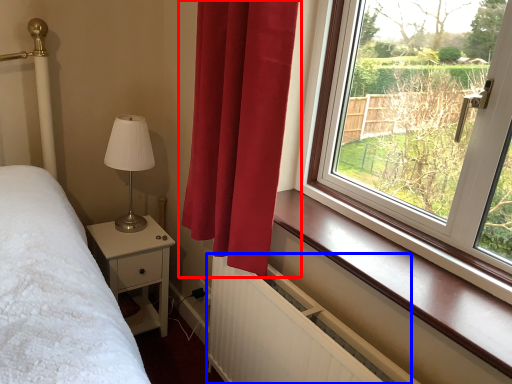
Question: Which of the following is the closest to the observer, curtain (highlighted by a red box) or radiator (highlighted by a blue box)?

Choices:
 (A) curtain
 (B) radiator

Answer: (B)